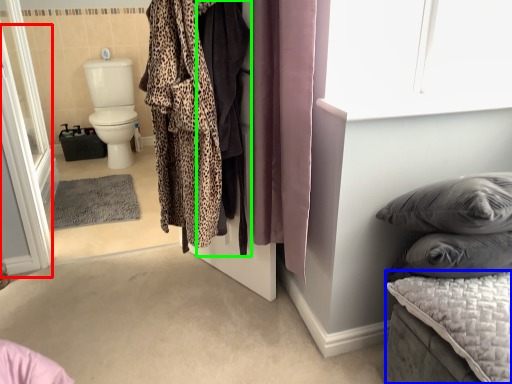
Question: Which object is the closest to the screen door (highlighted by a red box)? Choose among these: mattress (highlighted by a blue box) or cloak (highlighted by a green box).

Choices:
 (A) mattress
 (B) cloak

Answer: (B)